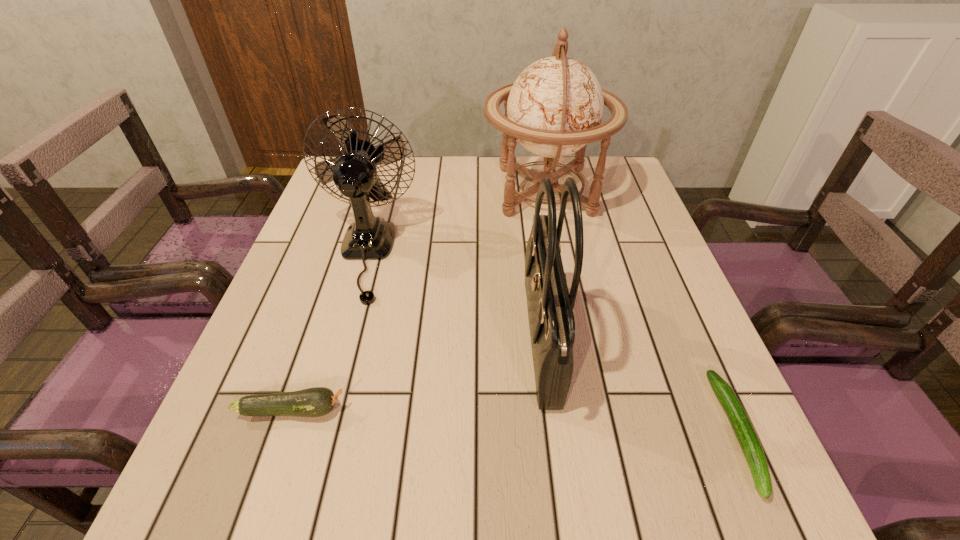
Locate an element on the screen. This screenshot has height=540, width=960. free space located with an open clasp on the front of the handbag is located at coordinates (452, 341).

At what (x,y) coordinates should I click in order to perform the action: click on vacant space located with an open clasp on the front of the handbag. Please return your answer as a coordinate pair (x, y). Looking at the image, I should click on (499, 341).

Find the location of a particular element. free location located with an open clasp on the front of the handbag is located at coordinates (370, 341).

The height and width of the screenshot is (540, 960). I want to click on free space located in front of the fan, indicating the direction of air flow, so click(x=292, y=513).

You are a GUI agent. You are given a task and a screenshot of the screen. Output one action in this format:
    pyautogui.click(x=<x>, y=<y>)
    Task: Click on the vacant space situated 0.340m at the blossom end of the second shortest object
    The width and height of the screenshot is (960, 540).
    Given the screenshot: What is the action you would take?
    pyautogui.click(x=547, y=410)

Image resolution: width=960 pixels, height=540 pixels. I want to click on object that is at the far edge, so coord(555,107).

The width and height of the screenshot is (960, 540). What are the coordinates of `object located at the near edge` in the screenshot? It's located at pyautogui.click(x=744, y=431).

Image resolution: width=960 pixels, height=540 pixels. Identify the location of fan that is at the left edge. (354, 173).

Image resolution: width=960 pixels, height=540 pixels. What are the coordinates of `zucchini that is at the left edge` in the screenshot? It's located at (318, 401).

Find the location of `globe that is at the right edge`. globe that is at the right edge is located at coordinates (555, 107).